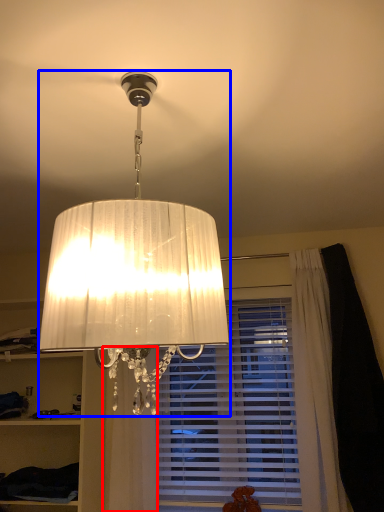
Question: Which of the following is the farthest to the observer, curtain (highlighted by a red box) or lamp (highlighted by a blue box)?

Choices:
 (A) curtain
 (B) lamp

Answer: (A)